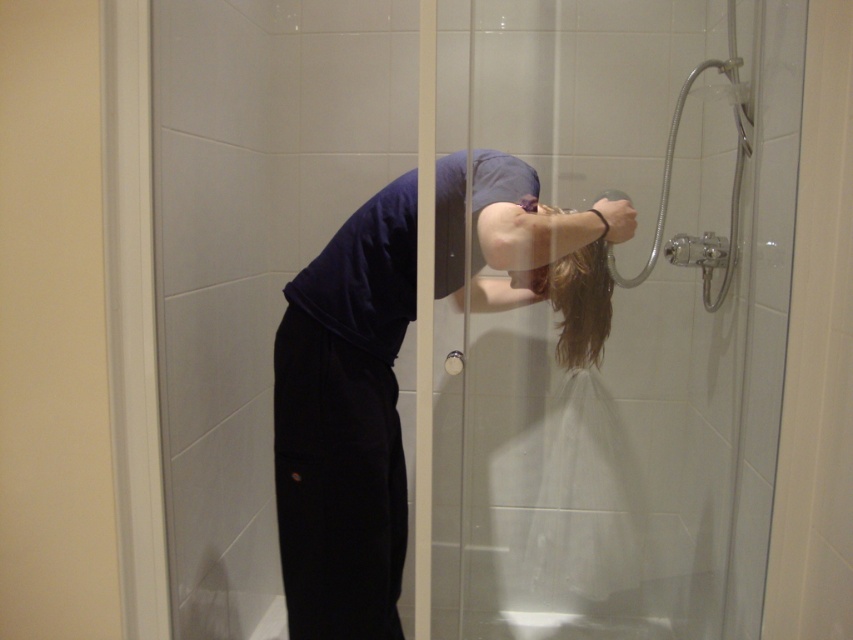
Is point (543, 544) positioned in front of point (672, 141)?

No.

Which is more to the right, transparent glass door at upper center or clear plastic hose at upper right?

clear plastic hose at upper right is more to the right.

Does point (505, 612) come in front of point (613, 266)?

No, it is behind (613, 266).

The width and height of the screenshot is (853, 640). Identify the location of transparent glass door at upper center. (622, 321).

Does transparent glass door at upper center appear under dark blue fabric at center?

Incorrect, transparent glass door at upper center is not positioned below dark blue fabric at center.

Between point (689, 96) and point (299, 465), which one is positioned in front?

Point (299, 465)

At what (x,y) coordinates should I click in order to perform the action: click on transparent glass door at upper center. Please return your answer as a coordinate pair (x, y). The width and height of the screenshot is (853, 640). Looking at the image, I should click on (622, 321).

Does dark blue fabric at center have a greater height compared to clear plastic hose at upper right?

Yes.

Who is lower down, dark blue fabric at center or clear plastic hose at upper right?

dark blue fabric at center is below.

The image size is (853, 640). Identify the location of dark blue fabric at center. (345, 422).

The image size is (853, 640). I want to click on dark blue fabric at center, so click(345, 422).